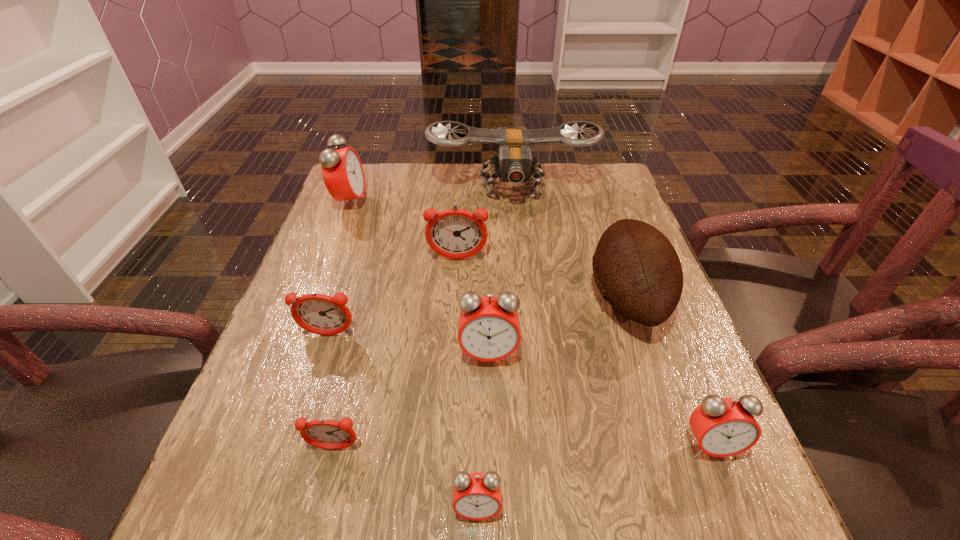
Where is `the smallest reddish-pink alarm clock`? The width and height of the screenshot is (960, 540). the smallest reddish-pink alarm clock is located at coordinates (327, 434).

What are the coordinates of `the nearest object` in the screenshot? It's located at (476, 496).

I want to click on the nearest red alarm clock, so click(x=476, y=496).

Locate an element on the screen. blank area located on the front-facing side of the yellow drone is located at coordinates (518, 261).

You are a GUI agent. You are given a task and a screenshot of the screen. Output one action in this format:
    pyautogui.click(x=<x>, y=<y>)
    Task: Click on the free space located 0.080m on the front-facing side of the tallest alarm clock
    The width and height of the screenshot is (960, 540).
    Given the screenshot: What is the action you would take?
    pyautogui.click(x=395, y=202)

You are a GUI agent. You are given a task and a screenshot of the screen. Output one action in this format:
    pyautogui.click(x=<x>, y=<y>)
    Task: Click on the vacant space situated on the laces of the brown football
    
    Given the screenshot: What is the action you would take?
    pyautogui.click(x=520, y=298)

Where is `free space located 0.180m on the laces of the brown football`? free space located 0.180m on the laces of the brown football is located at coordinates (507, 298).

Identify the location of vacant space situated on the laces of the brown football. (443, 298).

The image size is (960, 540). In order to click on vacant space located 0.270m on the front-facing side of the sixth nearest alarm clock in this screenshot , I will do `click(452, 356)`.

Image resolution: width=960 pixels, height=540 pixels. I want to click on vacant area situated on the front-facing side of the second farthest red alarm clock, so click(491, 470).